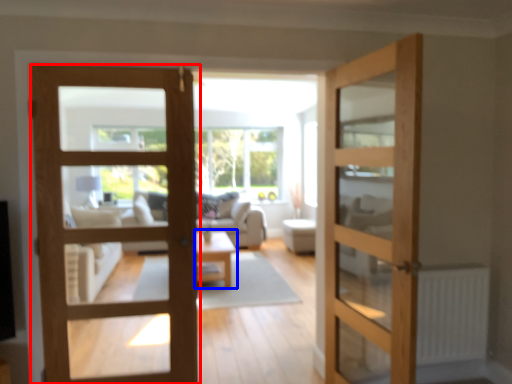
Question: Among these objects, which one is farthest to the camera, door (highlighted by a red box) or table (highlighted by a blue box)?

Choices:
 (A) door
 (B) table

Answer: (B)